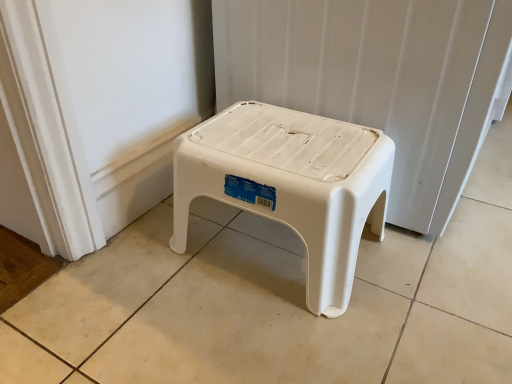
Find the location of a particular element. This screenshot has height=384, width=512. free space that is in between white plastic stool at center and white plastic stool at center is located at coordinates (373, 264).